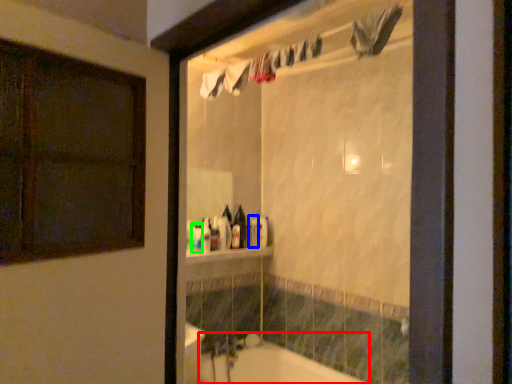
Question: Based on their relative distances, which object is nearer to bathtub (highlighted by a red box)? Choose from toiletry (highlighted by a blue box) and toiletry (highlighted by a green box).

Choices:
 (A) toiletry
 (B) toiletry

Answer: (A)